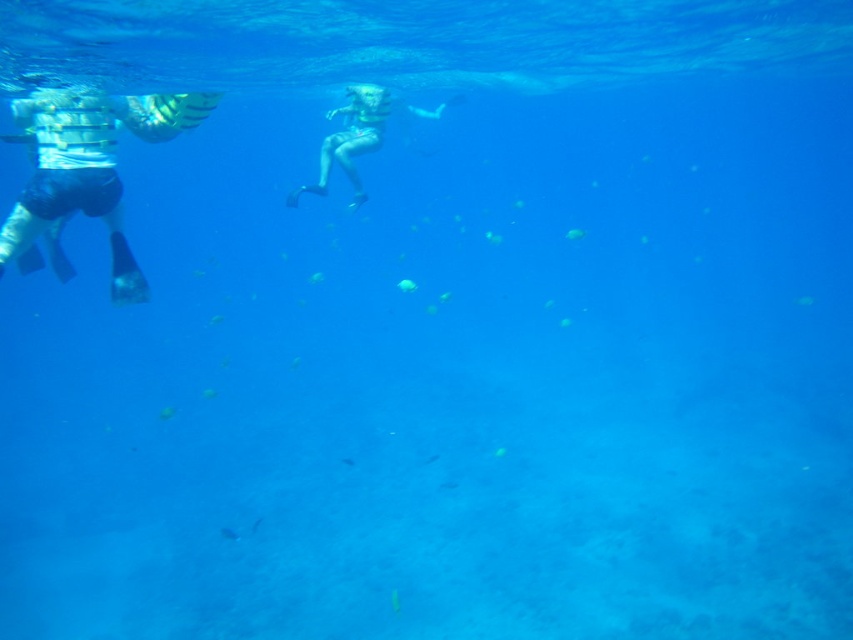
Who is more distant from viewer, (79, 179) or (376, 147)?

The point (376, 147) is behind.

What do you see at coordinates (88, 168) in the screenshot?
I see `white striped swim trunks at left` at bounding box center [88, 168].

The width and height of the screenshot is (853, 640). Find the location of `white striped swim trunks at left`. white striped swim trunks at left is located at coordinates click(x=88, y=168).

Find the location of `white striped swim trunks at left`. white striped swim trunks at left is located at coordinates (88, 168).

Is white striped swim trunks at left taller than translucent blue fish at lower center?

Yes.

Who is more distant from viewer, (61, 204) or (224, 536)?

The point (224, 536) is more distant.

Find the location of a particular element. The height and width of the screenshot is (640, 853). white striped swim trunks at left is located at coordinates (88, 168).

Is smooth skin diver at center shorter than translucent blue fish at lower center?

Incorrect, smooth skin diver at center's height does not fall short of translucent blue fish at lower center's.

Which is more to the right, smooth skin diver at center or translucent blue fish at lower center?

translucent blue fish at lower center

Between point (386, 115) and point (227, 529), which one is positioned behind?

Positioned behind is point (386, 115).

The image size is (853, 640). What are the coordinates of `smooth skin diver at center` in the screenshot? It's located at (350, 140).